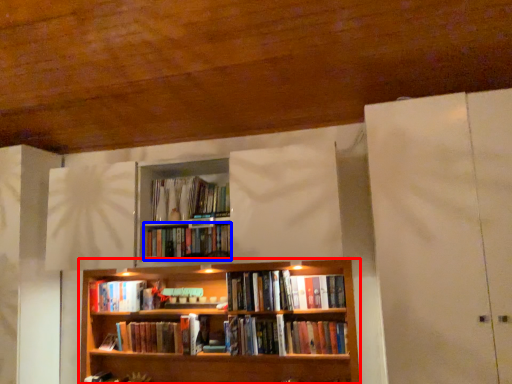
Question: Among these objects, which one is nearest to the camera, bookcase (highlighted by a red box) or book (highlighted by a blue box)?

Choices:
 (A) bookcase
 (B) book

Answer: (A)